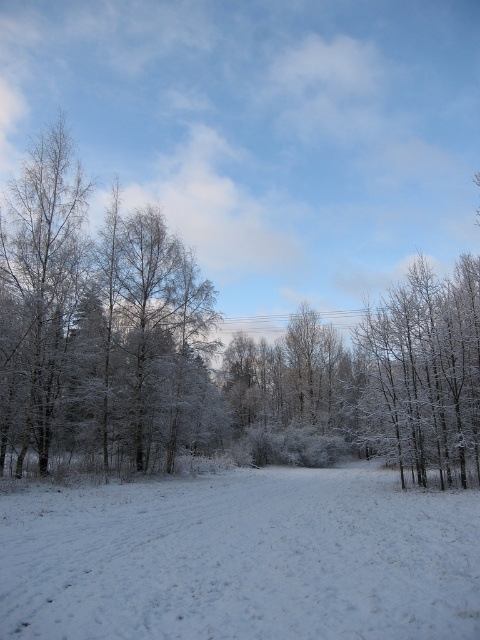
Question: From the image, what is the correct spatial relationship of white fluffy snow at center in relation to white frosty trees at right?

Choices:
 (A) above
 (B) below

Answer: (B)

Question: Based on their relative distances, which object is farther from the white frosty trees at right?

Choices:
 (A) white fluffy snow at center
 (B) white frosty tree at left

Answer: (B)

Question: Which point appears closest to the camera in this image?

Choices:
 (A) (37, 339)
 (B) (365, 371)

Answer: (A)

Question: Can you confirm if white frosty trees at right is thinner than white frosty tree at left?

Choices:
 (A) yes
 (B) no

Answer: (B)

Question: Which object appears farthest from the camera in this image?

Choices:
 (A) white fluffy snow at center
 (B) white frosty tree at left

Answer: (B)

Question: Does white fluffy snow at center appear on the right side of white frosty trees at right?

Choices:
 (A) yes
 (B) no

Answer: (B)